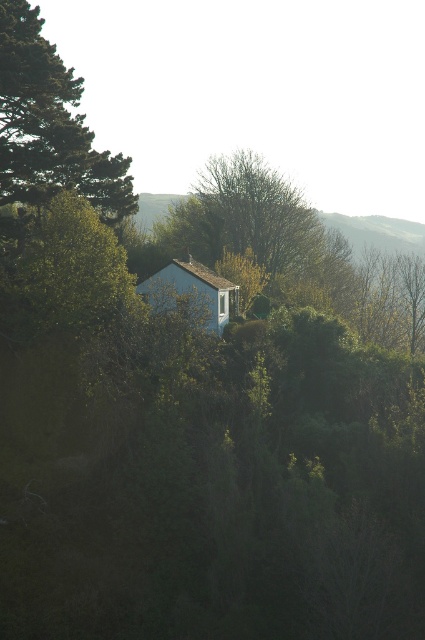
From the picture: Which is below, green leafy tree at left or blue matte hut at center?

blue matte hut at center is below.

Who is more distant from viewer, [0,179] or [198,268]?

Positioned behind is point [198,268].

Who is more forward, (64,147) or (153,307)?

Point (153,307) is in front.

Where is `green leafy tree at left`? This screenshot has width=425, height=640. green leafy tree at left is located at coordinates (50, 125).